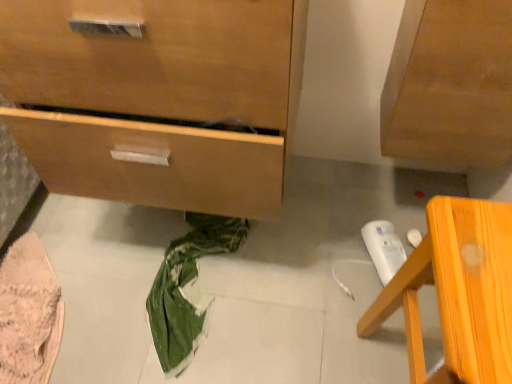
Locate an element on the screen. Image resolution: width=512 pixels, height=384 pixels. free spot above pink knitted fabric at lower left (from a real-world perspective) is located at coordinates (51, 289).